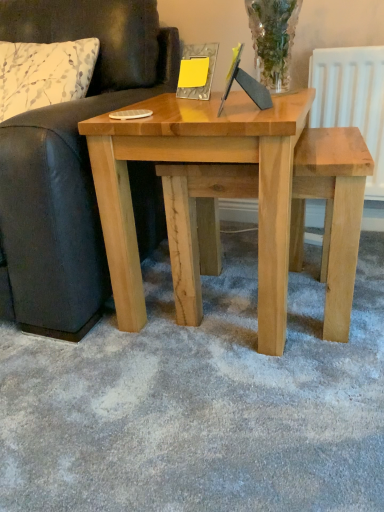
In order to face natural wood stool at center, should I rotate leftwards or rightwards?

Turn right approximately 9.302 degrees to face it.

Locate an element on the screen. This screenshot has width=384, height=512. leather couch at left is located at coordinates (71, 157).

Image resolution: width=384 pixels, height=512 pixels. Describe the element at coordinates (44, 74) in the screenshot. I see `white floral fabric pillow at left` at that location.

Locate an element on the screen. The height and width of the screenshot is (512, 384). natural wood table at center is located at coordinates (200, 162).

Is white floral fabric pillow at left behind leather couch at left?

Yes, the depth of white floral fabric pillow at left is greater than that of leather couch at left.

Considering the sizes of objects white floral fabric pillow at left and leather couch at left in the image provided, who is taller, white floral fabric pillow at left or leather couch at left?

Standing taller between the two is leather couch at left.

From the image's perspective, which is below, white floral fabric pillow at left or leather couch at left?

leather couch at left.

Is white floral fabric pillow at left positioned beyond the bounds of leather couch at left?

Actually, white floral fabric pillow at left is within leather couch at left.

Does natural wood stool at center appear on the left side of leather couch at left?

No, natural wood stool at center is not to the left of leather couch at left.

You are a GUI agent. You are given a task and a screenshot of the screen. Output one action in this format:
    pyautogui.click(x=<x>, y=<y>)
    Task: Click on the studio couch that is in front of the natural wood stool at center
    The height and width of the screenshot is (512, 384).
    Given the screenshot: What is the action you would take?
    pyautogui.click(x=71, y=157)

Would you say leather couch at left is part of natural wood stool at center's contents?

Definitely not — leather couch at left is not inside natural wood stool at center.

Is natural wood stool at center facing towards leather couch at left?

No, natural wood stool at center is not facing towards leather couch at left.

Between point (106, 285) and point (242, 126), which one is positioned in front?

Point (242, 126)

Does leather couch at left contain natural wood table at center?

No, natural wood table at center is not surrounded by leather couch at left.

From the image's perspective, which object appears higher, leather couch at left or natural wood table at center?

leather couch at left, from the image's perspective.

From a real-world perspective, which object rests below the other?

natural wood table at center, from a real-world perspective.

Which point is more distant from viewer, (182, 322) or (13, 105)?

Positioned behind is point (13, 105).

Is natural wood stool at center positioned far away from white floral fabric pillow at left?

Actually, natural wood stool at center and white floral fabric pillow at left are a little close together.

Is natural wood stool at center wider or thinner than white floral fabric pillow at left?

Clearly, natural wood stool at center has less width compared to white floral fabric pillow at left.

The image size is (384, 512). In order to click on pillow above the natural wood stool at center (from the image's perspective) in this screenshot , I will do `click(44, 74)`.

You are a GUI agent. You are given a task and a screenshot of the screen. Output one action in this format:
    pyautogui.click(x=<x>, y=<y>)
    Task: Click on the table lying in front of the natural wood stool at center
    The width and height of the screenshot is (384, 512).
    Given the screenshot: What is the action you would take?
    pyautogui.click(x=200, y=162)

In the scene shown: Could you tell me if natural wood stool at center is facing natural wood table at center?

Yes, natural wood stool at center faces towards natural wood table at center.

Measure the distance from natural wood stool at center to natural wood table at center.

13.67 centimeters.

Visually, is natural wood stool at center positioned to the left or to the right of natural wood table at center?

natural wood stool at center is positioned on natural wood table at center's right side.

From the picture: Considering the relative sizes of leather couch at left and natural wood stool at center in the image provided, is leather couch at left thinner than natural wood stool at center?

In fact, leather couch at left might be wider than natural wood stool at center.

Visually, is leather couch at left positioned to the left or to the right of natural wood stool at center?

leather couch at left is to the left of natural wood stool at center.

Is leather couch at left bigger or smaller than natural wood stool at center?

Considering their sizes, leather couch at left takes up more space than natural wood stool at center.

Is point (85, 193) closer to viewer compared to point (196, 322)?

Yes, point (85, 193) is closer to viewer.

How far apart are white floral fabric pillow at left and natural wood table at center?

They are 20.85 inches apart.

Between white floral fabric pillow at left and natural wood table at center, which one has smaller size?

white floral fabric pillow at left.

Is there a large distance between white floral fabric pillow at left and natural wood table at center?

That's not correct — white floral fabric pillow at left is a little close to natural wood table at center.

Looking at their sizes, would you say white floral fabric pillow at left is wider or thinner than natural wood table at center?

In the image, white floral fabric pillow at left appears to be more narrow than natural wood table at center.

Where is `pillow on the right of leather couch at left`? The width and height of the screenshot is (384, 512). pillow on the right of leather couch at left is located at coordinates (44, 74).

Locate an element on the screen. This screenshot has width=384, height=512. studio couch above the natural wood stool at center (from a real-world perspective) is located at coordinates (71, 157).

Considering their positions, is leather couch at left positioned closer to white floral fabric pillow at left than natural wood table at center?

The object closer to white floral fabric pillow at left is leather couch at left.

When comparing their distances from natural wood table at center, does leather couch at left or white floral fabric pillow at left seem closer?

leather couch at left is closer to natural wood table at center.

From the picture: Which object lies further to the anchor point natural wood stool at center, natural wood table at center or white floral fabric pillow at left?

The object further to natural wood stool at center is white floral fabric pillow at left.

Based on the photo, which object lies nearer to the anchor point natural wood table at center, white floral fabric pillow at left or leather couch at left?

leather couch at left.

Which object lies nearer to the anchor point white floral fabric pillow at left, natural wood stool at center or natural wood table at center?

natural wood table at center lies closer to white floral fabric pillow at left than the other object.

Looking at the image, which one is located closer to natural wood stool at center, natural wood table at center or leather couch at left?

natural wood table at center is positioned closer to the anchor natural wood stool at center.

When comparing their distances from leather couch at left, does white floral fabric pillow at left or natural wood stool at center seem further?

natural wood stool at center.

Looking at the image, which one is located further to white floral fabric pillow at left, natural wood table at center or natural wood stool at center?

Based on the image, natural wood stool at center appears to be further to white floral fabric pillow at left.

At what (x,y) coordinates should I click in order to perform the action: click on table between white floral fabric pillow at left and natural wood stool at center in the horizontal direction. Please return your answer as a coordinate pair (x, y). This screenshot has width=384, height=512. Looking at the image, I should click on (200, 162).

Identify the location of pillow between leather couch at left and natural wood stool at center. The height and width of the screenshot is (512, 384). (44, 74).

I want to click on pillow located between leather couch at left and natural wood table at center in the left-right direction, so click(x=44, y=74).

The height and width of the screenshot is (512, 384). I want to click on table between leather couch at left and natural wood stool at center, so click(x=200, y=162).